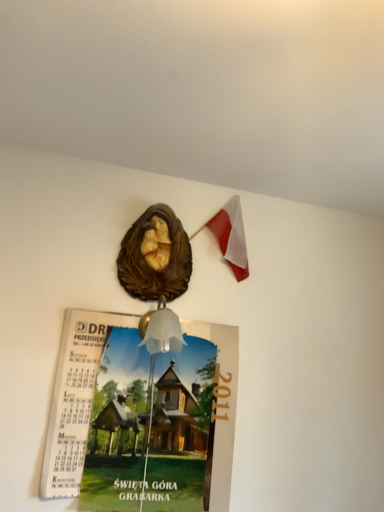
Question: Can you confirm if white fabric flag at upper right is taller than matte paper calendar at upper center?

Choices:
 (A) no
 (B) yes

Answer: (A)

Question: Does white fabric flag at upper right have a greater width compared to matte paper calendar at upper center?

Choices:
 (A) no
 (B) yes

Answer: (B)

Question: Does white fabric flag at upper right come behind matte paper calendar at upper center?

Choices:
 (A) yes
 (B) no

Answer: (A)

Question: Is matte paper calendar at upper center at the back of white fabric flag at upper right?

Choices:
 (A) yes
 (B) no

Answer: (B)

Question: From the image's perspective, would you say white fabric flag at upper right is shown under matte paper calendar at upper center?

Choices:
 (A) yes
 (B) no

Answer: (B)

Question: Is white fabric flag at upper right inside the boundaries of translucent glass bell at center, or outside?

Choices:
 (A) inside
 (B) outside

Answer: (B)

Question: Is white fabric flag at upper right wider or thinner than translucent glass bell at center?

Choices:
 (A) thin
 (B) wide

Answer: (A)

Question: From a real-world perspective, is white fabric flag at upper right positioned above or below translucent glass bell at center?

Choices:
 (A) below
 (B) above

Answer: (B)

Question: Visually, is white fabric flag at upper right positioned to the left or to the right of translucent glass bell at center?

Choices:
 (A) left
 (B) right

Answer: (B)

Question: From the image's perspective, is matte paper calendar at upper center located above or below white fabric flag at upper right?

Choices:
 (A) above
 (B) below

Answer: (B)

Question: Looking at the image, does matte paper calendar at upper center seem bigger or smaller compared to white fabric flag at upper right?

Choices:
 (A) big
 (B) small

Answer: (A)

Question: From a real-world perspective, is matte paper calendar at upper center above or below white fabric flag at upper right?

Choices:
 (A) below
 (B) above

Answer: (A)

Question: In terms of height, does matte paper calendar at upper center look taller or shorter compared to white fabric flag at upper right?

Choices:
 (A) short
 (B) tall

Answer: (B)

Question: In terms of height, does matte paper calendar at upper center look taller or shorter compared to translucent glass bell at center?

Choices:
 (A) tall
 (B) short

Answer: (A)

Question: Which is correct: matte paper calendar at upper center is inside translucent glass bell at center, or outside of it?

Choices:
 (A) inside
 (B) outside

Answer: (B)